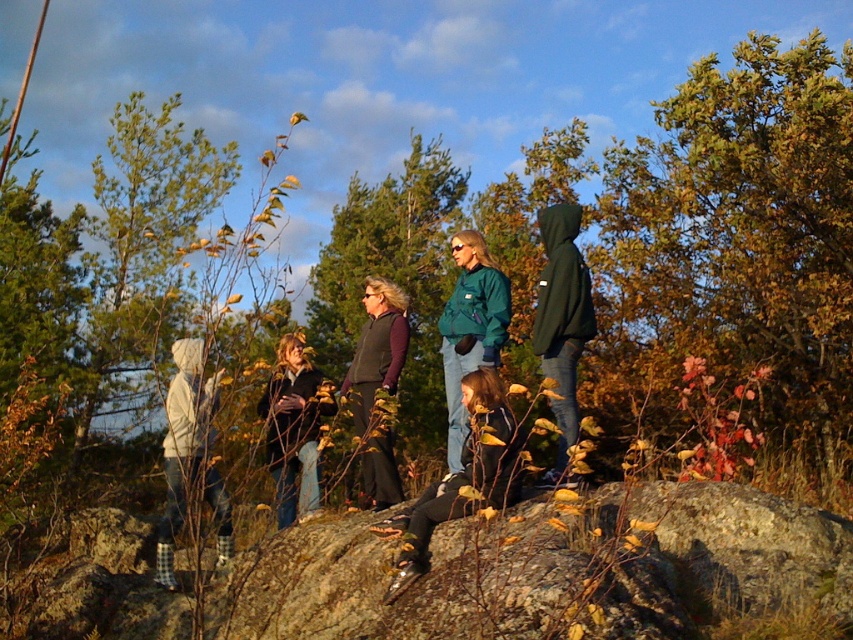
You are part of the group standing on the rocky terrain. You want to hand a map to the person wearing the dark green hoodie at center. Since you are facing the same direction as the group, which direction should you move to ensure the map reaches the correct person without passing it through the matte black jacket at center?

The dark green hoodie at center is in front of the matte black jacket at center, so you should move forward towards the dark green hoodie at center to hand the map directly without needing to go around the matte black jacket at center.

You are part of the group standing on the rocky terrain. You notice two points marked in the scene. The first point is at coordinates point (x=560, y=474) and the second is at point (x=280, y=458). If you want to walk from the first point to the second point, will you be moving towards the background or the foreground of the image?

Since point (x=560, y=474) is in front of point (x=280, y=458), moving from the first point to the second point means you are walking towards the background of the image.